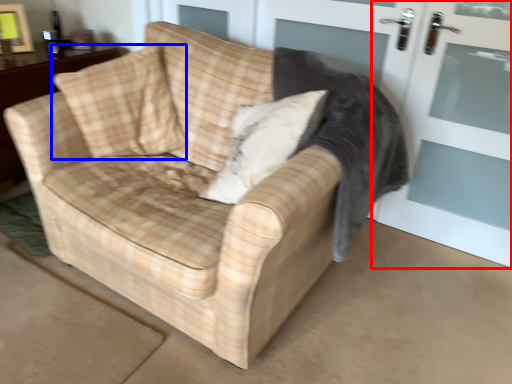
Question: Which object is closer to the camera taking this photo, screen door (highlighted by a red box) or throw pillow (highlighted by a blue box)?

Choices:
 (A) screen door
 (B) throw pillow

Answer: (A)